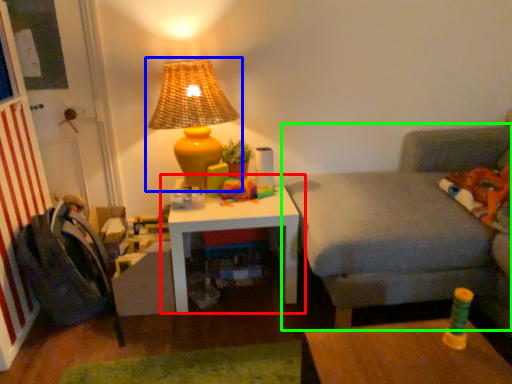
Question: Based on their relative distances, which object is farther from table (highlighted by a red box)? Choose from lamp (highlighted by a blue box) and studio couch (highlighted by a green box).

Choices:
 (A) lamp
 (B) studio couch

Answer: (B)